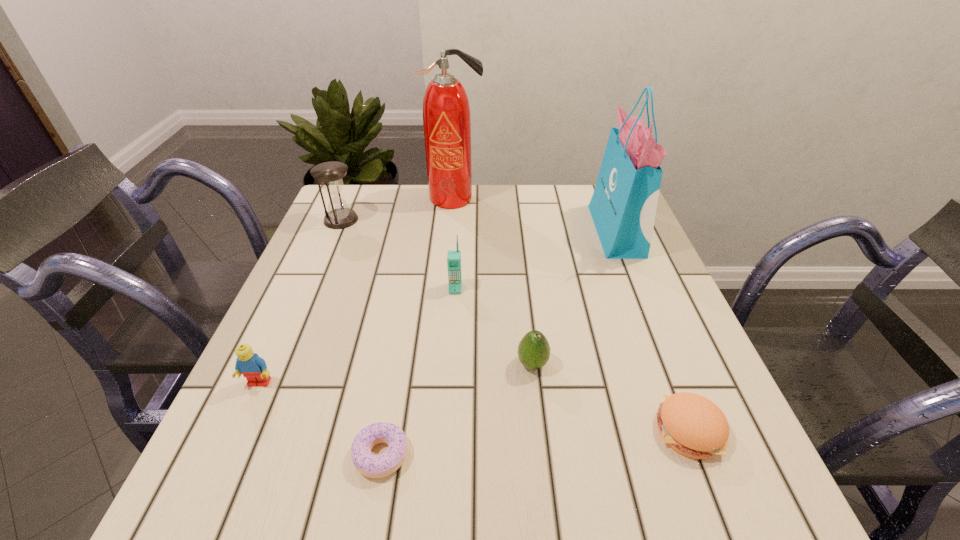
Locate an element on the screen. fire extinguisher is located at coordinates (446, 112).

I want to click on shopping bag, so click(623, 207).

Locate an element on the screen. This screenshot has width=960, height=540. hourglass is located at coordinates [330, 174].

Locate an element on the screen. The image size is (960, 540). the fourth farthest object is located at coordinates (453, 256).

What are the coordinates of `Lego` in the screenshot? It's located at (254, 368).

Find the location of a particular element. The width and height of the screenshot is (960, 540). the sixth object from left to right is located at coordinates (533, 350).

What are the coordinates of `the second shortest object` in the screenshot? It's located at (692, 425).

The height and width of the screenshot is (540, 960). In order to click on doughnut in this screenshot , I will do `click(374, 466)`.

Identify the location of free spot located on the front of the fire extinguisher. This screenshot has width=960, height=540. (448, 271).

Identify the location of free location located 0.110m on the front of the shopping bag. (641, 293).